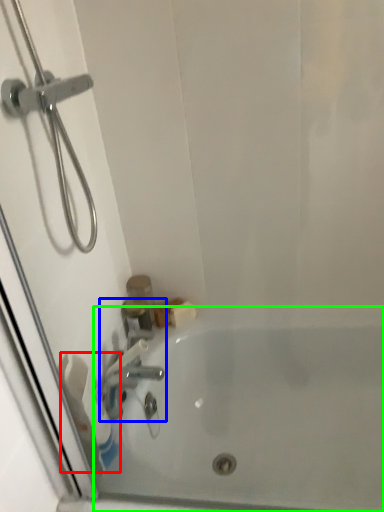
Question: Based on their relative distances, which object is farther from toilet paper (highlighted by a red box)? Choose from tap (highlighted by a blue box) and bathtub (highlighted by a green box).

Choices:
 (A) tap
 (B) bathtub

Answer: (B)